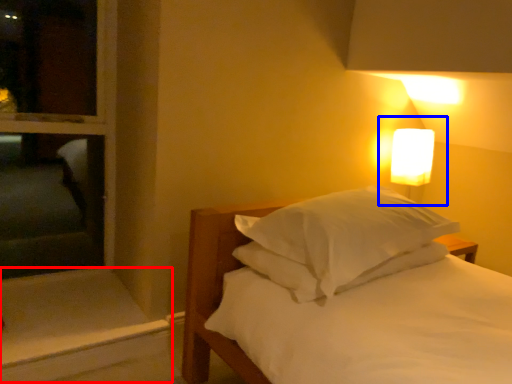
Question: Which object is further to the camera taking this photo, window sill (highlighted by a red box) or bedside lamp (highlighted by a blue box)?

Choices:
 (A) window sill
 (B) bedside lamp

Answer: (B)